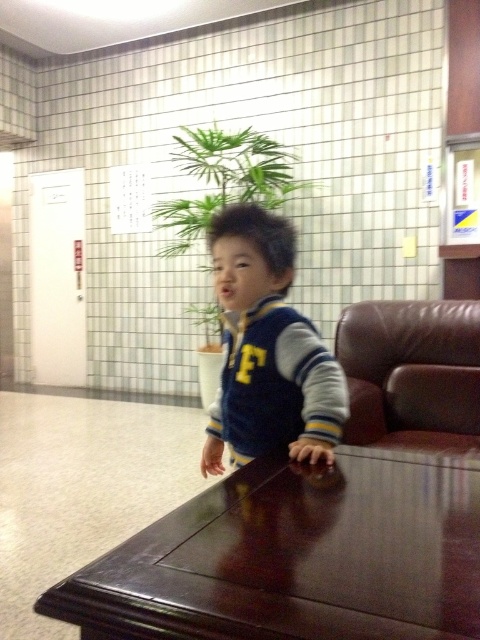
You are a parent trying to put a blue fleece jacket at center on a brown leather armchair at right. Is the jacket currently on the chair?

The blue fleece jacket at center is positioned over brown leather armchair at right, so yes, the jacket is currently on the chair.

You are a visitor at a school and see the blue fleece jacket at center and the brown leather armchair at right. Which object is closer to the entrance if the entrance is on the left side of the room?

The blue fleece jacket at center is closer to the entrance because it is positioned to the left of the brown leather armchair at right, and the entrance is on the left side of the room.

You are a parent trying to decide if your child can reach a snack placed on the dark brown polished wood table at center while wearing the blue fleece jacket at center. Can they reach it?

The dark brown polished wood table at center has a lesser height compared to blue fleece jacket at center. Since the table is shorter than the jacket, the child wearing the jacket might have an easier time reaching the snack on the table.